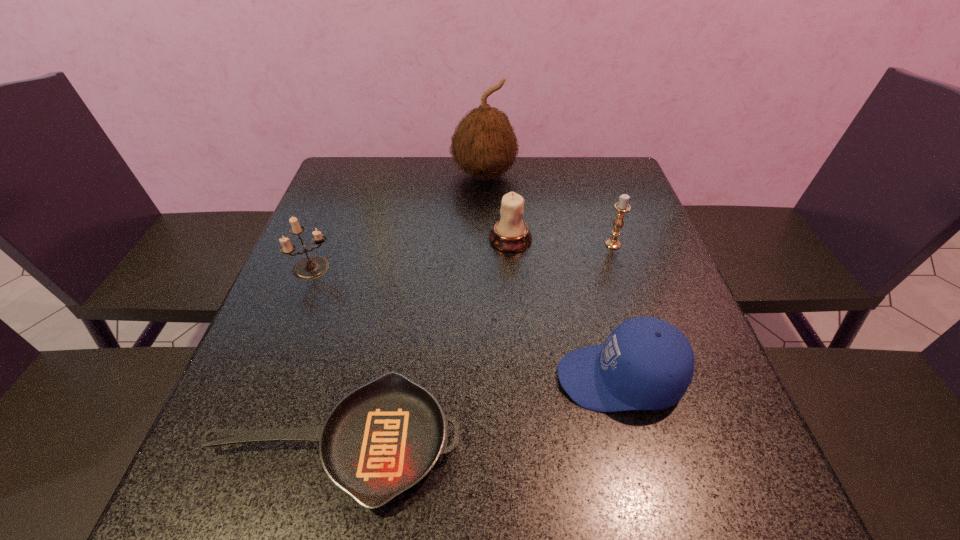
Locate an element on the screen. The height and width of the screenshot is (540, 960). coconut is located at coordinates (484, 144).

Find the location of a particular element. The image size is (960, 540). the farthest object is located at coordinates (484, 144).

Where is `the rightmost candle holder`? the rightmost candle holder is located at coordinates (622, 207).

What are the coordinates of `the second candle holder from left to right` in the screenshot? It's located at click(510, 234).

At what (x,y) coordinates should I click in order to perform the action: click on cap. Please return your answer as a coordinate pair (x, y). The image size is (960, 540). Looking at the image, I should click on (646, 363).

Locate an element on the screen. This screenshot has width=960, height=540. the fourth farthest object is located at coordinates (311, 267).

At what (x,y) coordinates should I click in order to perform the action: click on the leftmost candle holder. Please return your answer as a coordinate pair (x, y). This screenshot has width=960, height=540. Looking at the image, I should click on (311, 267).

Where is `frying pan`? frying pan is located at coordinates (384, 437).

Where is `blank area located on the surface of the farthest object`? blank area located on the surface of the farthest object is located at coordinates (486, 288).

This screenshot has height=540, width=960. What are the coordinates of `free space located 0.260m on the left of the rightmost candle holder` in the screenshot? It's located at (500, 244).